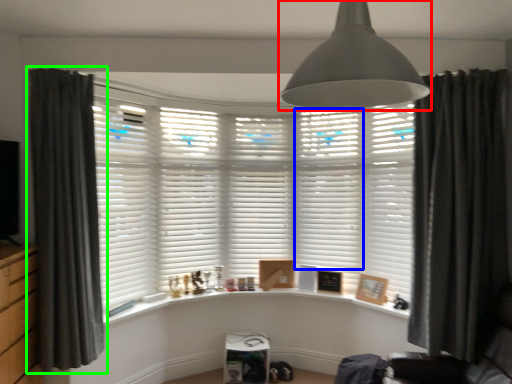
Question: Which is nearer to the light fixture (highlighted by a red box)? shutter (highlighted by a blue box) or curtain (highlighted by a green box).

Choices:
 (A) shutter
 (B) curtain

Answer: (B)